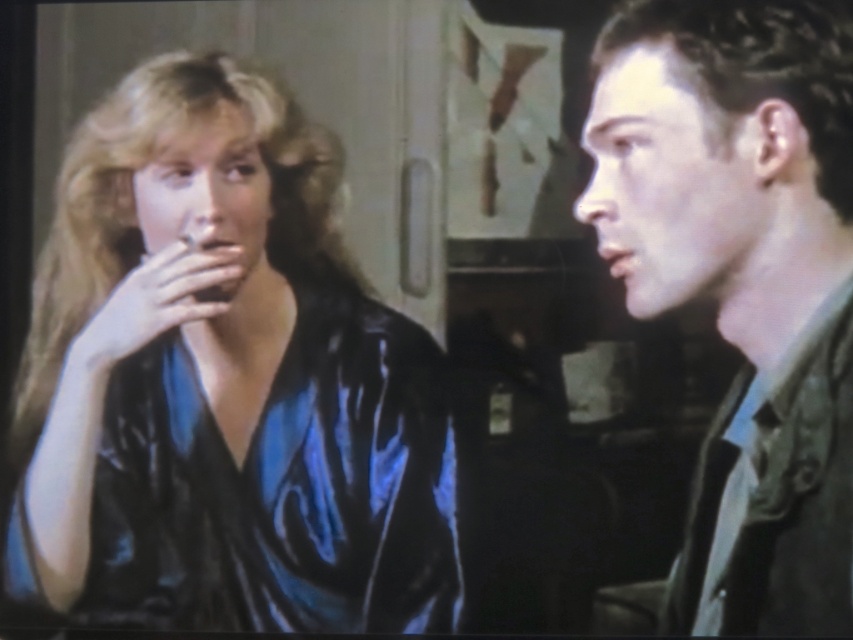
You are standing at the camera position looking at the scene. There is a point marked at coordinates point (711, 624). Can you reach this point without moving your body?

The distance between point (711, 624) and the camera is 5.27 feet, so you cannot reach it without moving your body since it is too far away.

You are standing in the room and want to locate the shiny blue silk blouse at left. According to the coordinates provided, where should you look?

The shiny blue silk blouse at left is located at coordinates point (x=223, y=381).